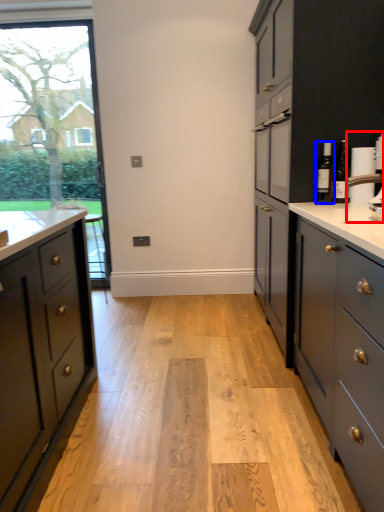
Question: Which object appears farthest to the camera in this image, coffee machine (highlighted by a red box) or bottle (highlighted by a blue box)?

Choices:
 (A) coffee machine
 (B) bottle

Answer: (B)